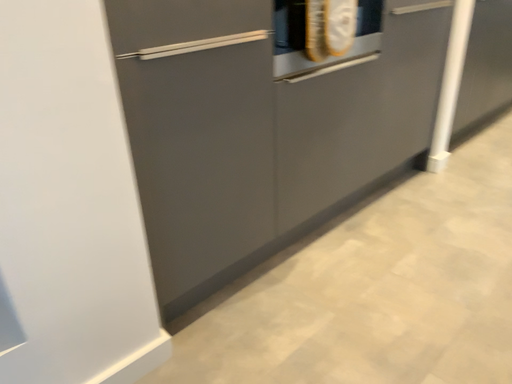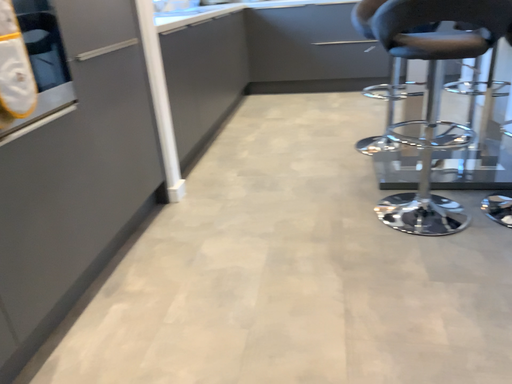
Question: Which way did the camera rotate in the video?

Choices:
 (A) rotated downward
 (B) rotated upward

Answer: (B)